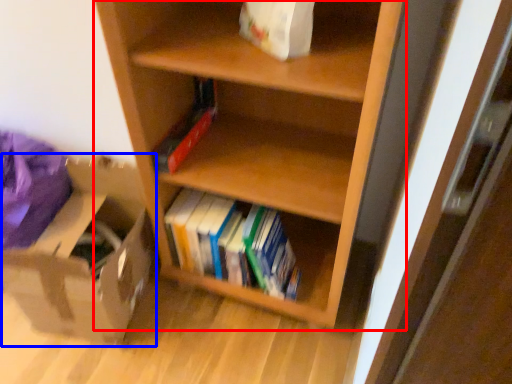
Question: Which object is further to the camera taking this photo, shelf (highlighted by a red box) or cardboard box (highlighted by a blue box)?

Choices:
 (A) shelf
 (B) cardboard box

Answer: (B)